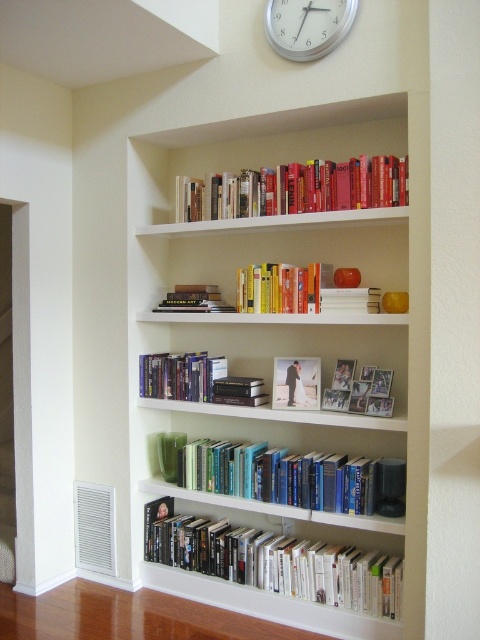
Question: Is white glossy book at lower center closer to camera compared to hardcover books at center?

Choices:
 (A) yes
 (B) no

Answer: (A)

Question: Is white glossy book at lower center closer to the viewer compared to hardcover books at upper center?

Choices:
 (A) yes
 (B) no

Answer: (B)

Question: Which of the following is the farthest from the observer?

Choices:
 (A) (291, 44)
 (B) (212, 396)
 (C) (242, 193)
 (D) (171, 499)

Answer: (D)

Question: Is white matte bookcase at upper center below silver metallic clock at upper center?

Choices:
 (A) no
 (B) yes

Answer: (B)

Question: Which of the following is the farthest from the observer?

Choices:
 (A) (348, 545)
 (B) (396, 540)
 (C) (286, 54)

Answer: (A)

Question: Among these objects, which one is farthest from the camera?

Choices:
 (A) hardcover books at upper center
 (B) hardcover books at center
 (C) silver metallic clock at upper center
 (D) white glossy book at lower center

Answer: (B)